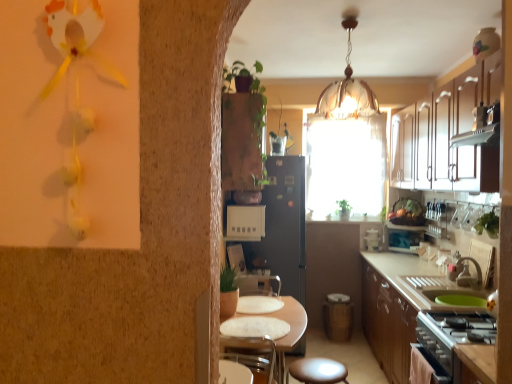
Question: Considering the relative sizes of white textured table at center and translucent glass chandelier at upper center in the image provided, is white textured table at center bigger than translucent glass chandelier at upper center?

Choices:
 (A) yes
 (B) no

Answer: (A)

Question: Would you say white textured table at center is a long distance from translucent glass chandelier at upper center?

Choices:
 (A) yes
 (B) no

Answer: (A)

Question: From a real-world perspective, is white textured table at center on translucent glass chandelier at upper center?

Choices:
 (A) no
 (B) yes

Answer: (A)

Question: Could you tell me if white textured table at center is facing translucent glass chandelier at upper center?

Choices:
 (A) yes
 (B) no

Answer: (B)

Question: Is white textured table at center taller than translucent glass chandelier at upper center?

Choices:
 (A) yes
 (B) no

Answer: (A)

Question: Can you confirm if white textured table at center is wider than translucent glass chandelier at upper center?

Choices:
 (A) yes
 (B) no

Answer: (A)

Question: Does green leafy plant at right, the 2th plant positioned from the top, have a smaller size compared to matte brown stool at lower center?

Choices:
 (A) no
 (B) yes

Answer: (B)

Question: Is green leafy plant at right, marked as the first plant in a front-to-back arrangement, shorter than matte brown stool at lower center?

Choices:
 (A) yes
 (B) no

Answer: (A)

Question: Is green leafy plant at right, the 1th plant when ordered from bottom to top, next to matte brown stool at lower center?

Choices:
 (A) no
 (B) yes

Answer: (A)

Question: Is green leafy plant at right, placed as the 2th plant when sorted from back to front, positioned before matte brown stool at lower center?

Choices:
 (A) yes
 (B) no

Answer: (B)

Question: Is green leafy plant at right, the 1th plant when ordered from bottom to top, not near matte brown stool at lower center?

Choices:
 (A) no
 (B) yes

Answer: (B)

Question: Is green leafy plant at right, placed as the 2th plant when sorted from back to front, further to the viewer compared to matte brown stool at lower center?

Choices:
 (A) yes
 (B) no

Answer: (A)

Question: Can you confirm if green leafy plant at right, the 1th plant positioned from the right, is positioned to the right of black matte refrigerator at center?

Choices:
 (A) no
 (B) yes

Answer: (B)